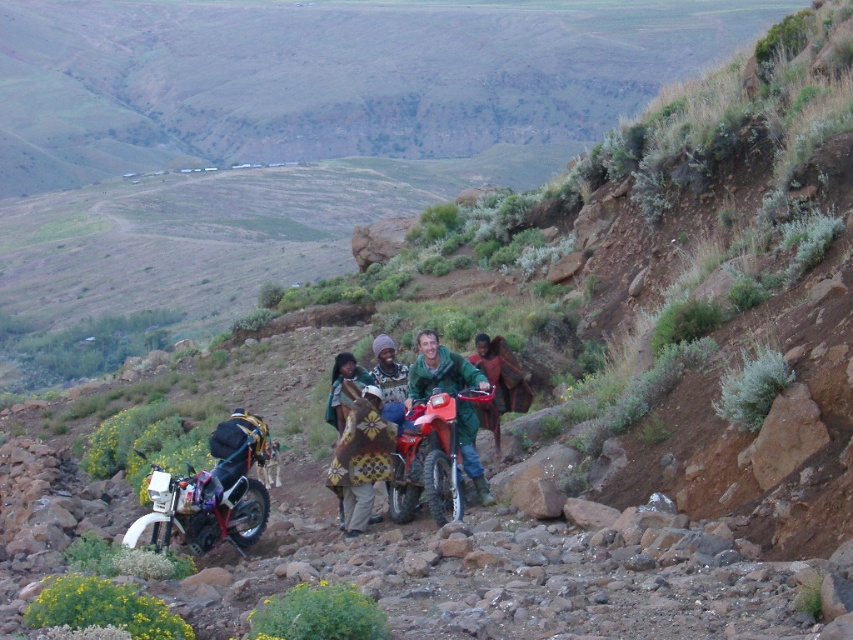
Question: Is matte black motorcycle at lower left positioned behind knitted woolen shawl at center?

Choices:
 (A) yes
 (B) no

Answer: (B)

Question: Which of the following is the closest to the observer?

Choices:
 (A) knitted wool sweater at center
 (B) matte red dirt bike at center

Answer: (B)

Question: Does matte black motorcycle at lower left have a lesser width compared to matte red dirt bike at center?

Choices:
 (A) no
 (B) yes

Answer: (A)

Question: Which is farther from the knitted wool sweater at center?

Choices:
 (A) matte red dirt bike at center
 (B) matte black motorcycle at lower left
 (C) knitted woolen shawl at center

Answer: (B)

Question: Which point is farther from the camera taking this photo?

Choices:
 (A) (376, 474)
 (B) (196, 508)
 (C) (383, 364)
 (D) (395, 452)

Answer: (C)

Question: Can you confirm if matte black motorcycle at lower left is bigger than knitted woolen shawl at center?

Choices:
 (A) yes
 (B) no

Answer: (A)